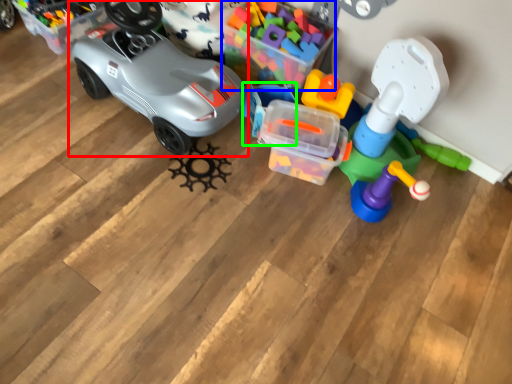
Question: Based on their relative distances, which object is nearer to car (highlighted by a red box)? Choose from toy (highlighted by a blue box) and toy (highlighted by a green box).

Choices:
 (A) toy
 (B) toy

Answer: (B)